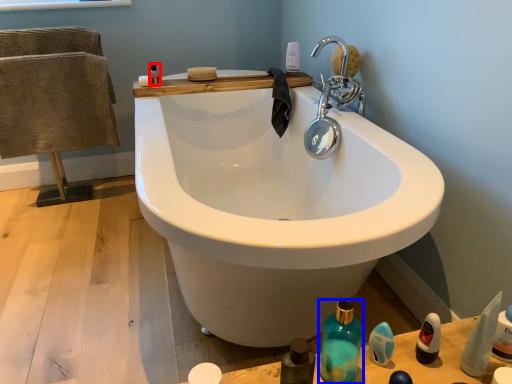
Question: Which object appears farthest to the camera in this image, mouthwash (highlighted by a red box) or bottle (highlighted by a blue box)?

Choices:
 (A) mouthwash
 (B) bottle

Answer: (A)